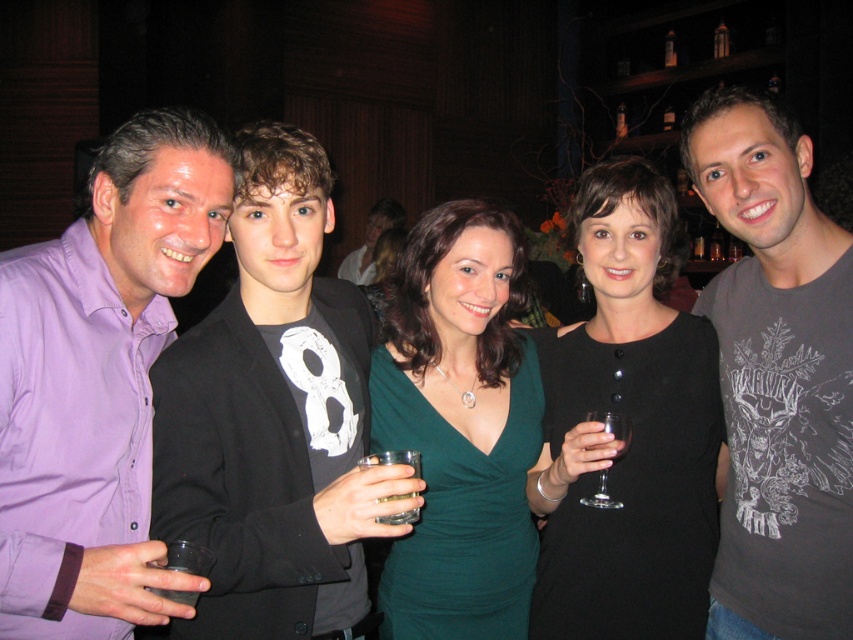
You are planning to take a photo of the purple shirt at left and the green satin dress at center. Which clothing item appears bigger in the photo?

The purple shirt at left appears bigger in the photo because it has a larger size compared to the green satin dress at center.

You are a photographer at this event and need to adjust the lighting to ensure both the purple shirt at left and the green satin dress at center are well lit. Based on their positions, which one is higher up in the frame?

The purple shirt at left is above the green satin dress at center in the frame, so you should adjust the lighting to account for its higher position.